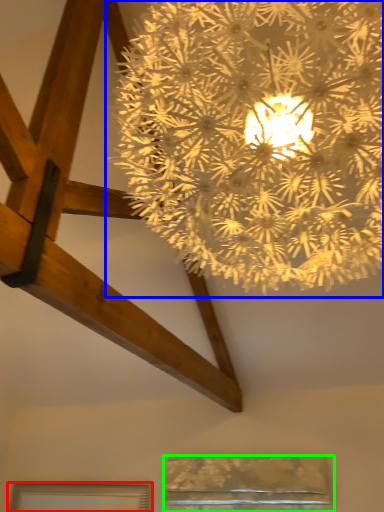
Question: Which object is positioned farthest from window (highlighted by a red box)? Select from lamp (highlighted by a blue box) and window (highlighted by a green box).

Choices:
 (A) lamp
 (B) window

Answer: (A)